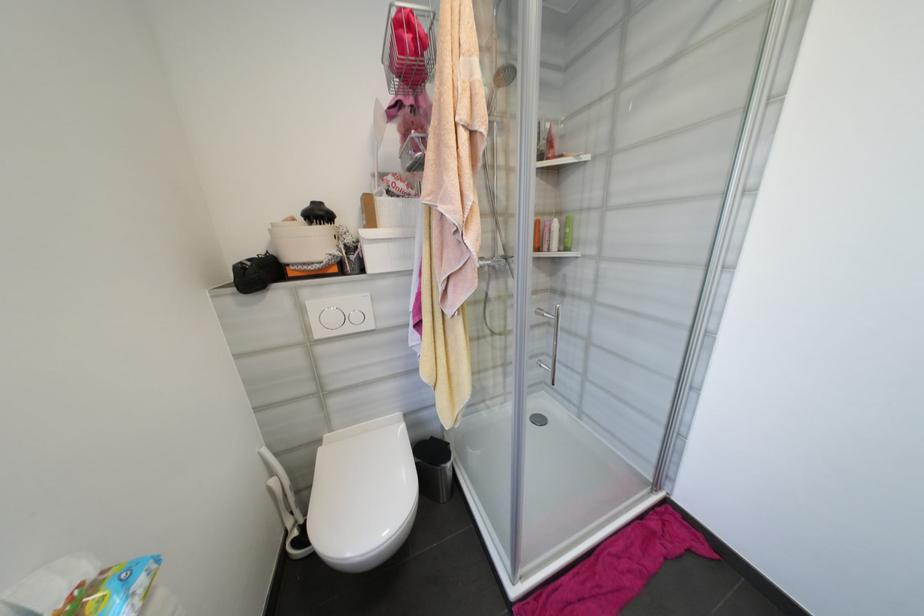
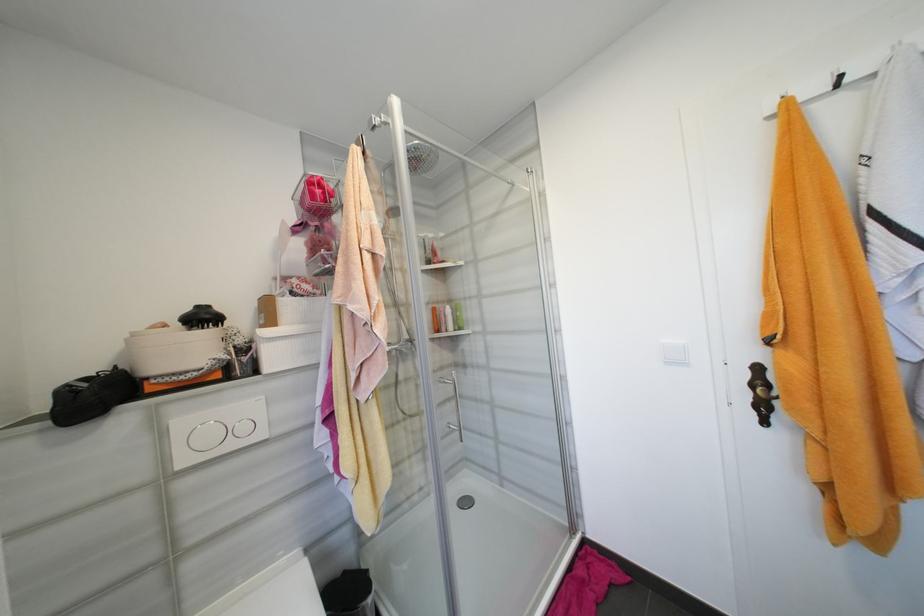
The point at (x=361, y=249) is marked in the first image. Where is the corresponding point in the second image?

(256, 349)